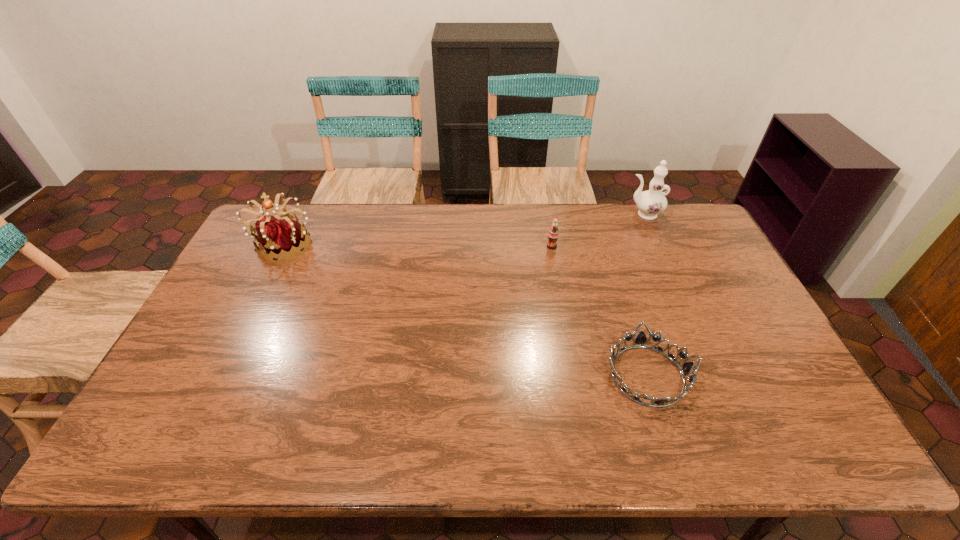
Where is `object that is positioned at the far left corner`? object that is positioned at the far left corner is located at coordinates (282, 237).

What are the coordinates of `object situated at the far right corner` in the screenshot? It's located at (650, 203).

Locate an element on the screen. blank space at the far edge of the desktop is located at coordinates (534, 241).

Locate an element on the screen. The width and height of the screenshot is (960, 540). free space at the near edge of the desktop is located at coordinates pos(481,426).

Where is `vacant area at the right edge`? The image size is (960, 540). vacant area at the right edge is located at coordinates (706, 300).

What are the coordinates of `free space at the far right corner of the desktop` in the screenshot? It's located at (694, 237).

Find the location of a particular element. The width and height of the screenshot is (960, 540). blank region between the chinaware and the nearest object is located at coordinates (645, 295).

You are a GUI agent. You are given a task and a screenshot of the screen. Output one action in this format:
    pyautogui.click(x=<x>, y=<y>)
    Task: Click on the vacant space in between the farther tiara and the right tiara
    This screenshot has width=960, height=540.
    Given the screenshot: What is the action you would take?
    (466, 310)

This screenshot has width=960, height=540. Find the location of `free space between the soda and the farthest object`. free space between the soda and the farthest object is located at coordinates (598, 231).

The image size is (960, 540). Find the location of `free space between the third object from right to left and the nearest object`. free space between the third object from right to left and the nearest object is located at coordinates (599, 311).